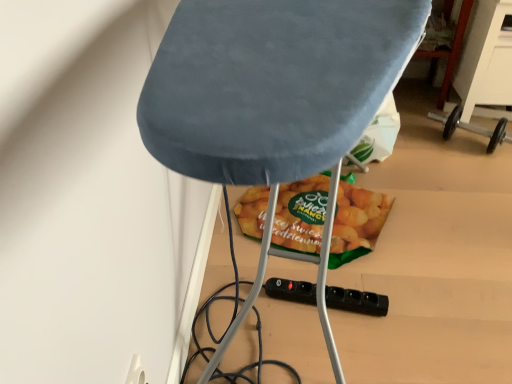
Question: Is the position of black plastic socket at lower center more distant than that of velvet blue ironing board at center?

Choices:
 (A) no
 (B) yes

Answer: (B)

Question: Is black plastic socket at lower center not close to velvet blue ironing board at center?

Choices:
 (A) yes
 (B) no

Answer: (B)

Question: Can you confirm if black plastic socket at lower center is wider than velvet blue ironing board at center?

Choices:
 (A) yes
 (B) no

Answer: (B)

Question: Can you confirm if black plastic socket at lower center is shorter than velvet blue ironing board at center?

Choices:
 (A) yes
 (B) no

Answer: (A)

Question: From a real-world perspective, is black plastic socket at lower center positioned over velvet blue ironing board at center based on gravity?

Choices:
 (A) no
 (B) yes

Answer: (A)

Question: Is black plastic socket at lower center facing towards velvet blue ironing board at center?

Choices:
 (A) yes
 (B) no

Answer: (A)

Question: Is black plastic socket at lower center with green matte snack at center?

Choices:
 (A) no
 (B) yes

Answer: (A)

Question: Is black plastic socket at lower center to the left of green matte snack at center from the viewer's perspective?

Choices:
 (A) yes
 (B) no

Answer: (B)

Question: Can you confirm if black plastic socket at lower center is bigger than green matte snack at center?

Choices:
 (A) yes
 (B) no

Answer: (B)

Question: Is the position of black plastic socket at lower center less distant than that of green matte snack at center?

Choices:
 (A) yes
 (B) no

Answer: (A)

Question: Could green matte snack at center be considered to be inside black plastic socket at lower center?

Choices:
 (A) no
 (B) yes

Answer: (A)

Question: Does black plastic socket at lower center have a greater height compared to green matte snack at center?

Choices:
 (A) no
 (B) yes

Answer: (A)

Question: Can you confirm if velvet blue ironing board at center is positioned to the left of black plastic socket at lower center?

Choices:
 (A) yes
 (B) no

Answer: (A)